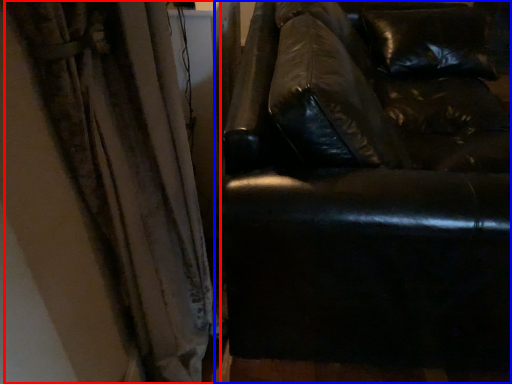
Question: Which object appears closest to the camera in this image, curtain (highlighted by a red box) or studio couch (highlighted by a blue box)?

Choices:
 (A) curtain
 (B) studio couch

Answer: (A)